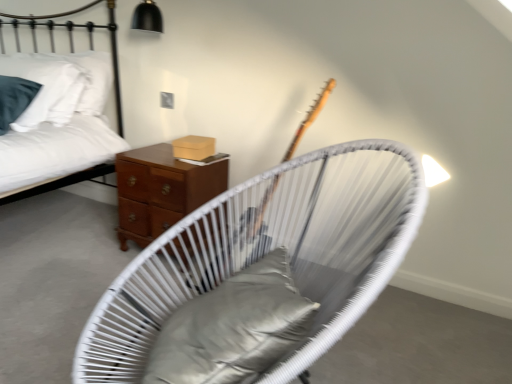
Question: Considering the relative sizes of satin gray pillow at center and mahogany wood nightstand at center in the image provided, is satin gray pillow at center thinner than mahogany wood nightstand at center?

Choices:
 (A) no
 (B) yes

Answer: (B)

Question: From the image's perspective, is satin gray pillow at center beneath mahogany wood nightstand at center?

Choices:
 (A) yes
 (B) no

Answer: (A)

Question: From a real-world perspective, is satin gray pillow at center positioned under mahogany wood nightstand at center based on gravity?

Choices:
 (A) yes
 (B) no

Answer: (B)

Question: Does satin gray pillow at center turn towards mahogany wood nightstand at center?

Choices:
 (A) yes
 (B) no

Answer: (B)

Question: Considering the relative sizes of satin gray pillow at center and mahogany wood nightstand at center in the image provided, is satin gray pillow at center smaller than mahogany wood nightstand at center?

Choices:
 (A) yes
 (B) no

Answer: (A)

Question: Is white cotton bed at upper left situated inside satin gray pillow at center or outside?

Choices:
 (A) outside
 (B) inside

Answer: (A)

Question: Looking at the image, does white cotton bed at upper left seem bigger or smaller compared to satin gray pillow at center?

Choices:
 (A) big
 (B) small

Answer: (A)

Question: From the image's perspective, is white cotton bed at upper left located above or below satin gray pillow at center?

Choices:
 (A) below
 (B) above

Answer: (B)

Question: Considering the relative positions of white cotton bed at upper left and satin gray pillow at center in the image provided, is white cotton bed at upper left to the left or to the right of satin gray pillow at center?

Choices:
 (A) left
 (B) right

Answer: (A)

Question: Considering the positions of mahogany wood nightstand at center and white cotton bed at upper left in the image, is mahogany wood nightstand at center wider or thinner than white cotton bed at upper left?

Choices:
 (A) wide
 (B) thin

Answer: (B)

Question: Looking at the image, does mahogany wood nightstand at center seem bigger or smaller compared to white cotton bed at upper left?

Choices:
 (A) big
 (B) small

Answer: (B)

Question: Is mahogany wood nightstand at center inside the boundaries of white cotton bed at upper left, or outside?

Choices:
 (A) outside
 (B) inside

Answer: (A)

Question: Based on their positions, is mahogany wood nightstand at center located to the left or right of white cotton bed at upper left?

Choices:
 (A) left
 (B) right

Answer: (B)

Question: Is mahogany wood nightstand at center taller or shorter than satin gray pillow at center?

Choices:
 (A) tall
 (B) short

Answer: (A)

Question: From a real-world perspective, is mahogany wood nightstand at center physically located above or below satin gray pillow at center?

Choices:
 (A) above
 (B) below

Answer: (B)